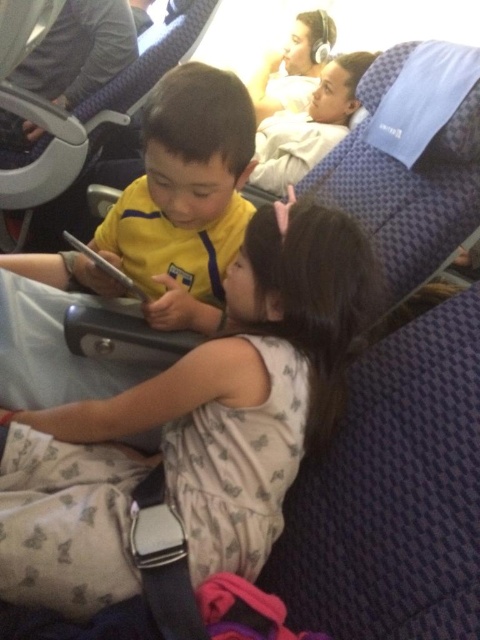
Question: Which of these objects is positioned closest to the matte white headphones at upper center?

Choices:
 (A) yellow matte shirt at center
 (B) light beige fabric dress at center

Answer: (A)

Question: Is yellow matte shirt at center above matte white headphones at upper center?

Choices:
 (A) yes
 (B) no

Answer: (B)

Question: Which point is closer to the camera?

Choices:
 (A) light beige fabric dress at center
 (B) matte white headphones at upper center

Answer: (A)

Question: Which object appears farthest from the camera in this image?

Choices:
 (A) yellow matte shirt at center
 (B) matte white headphones at upper center

Answer: (B)

Question: Can you confirm if light beige fabric dress at center is positioned below yellow matte shirt at center?

Choices:
 (A) no
 (B) yes

Answer: (B)

Question: Is yellow matte shirt at center bigger than matte white headphones at upper center?

Choices:
 (A) yes
 (B) no

Answer: (B)